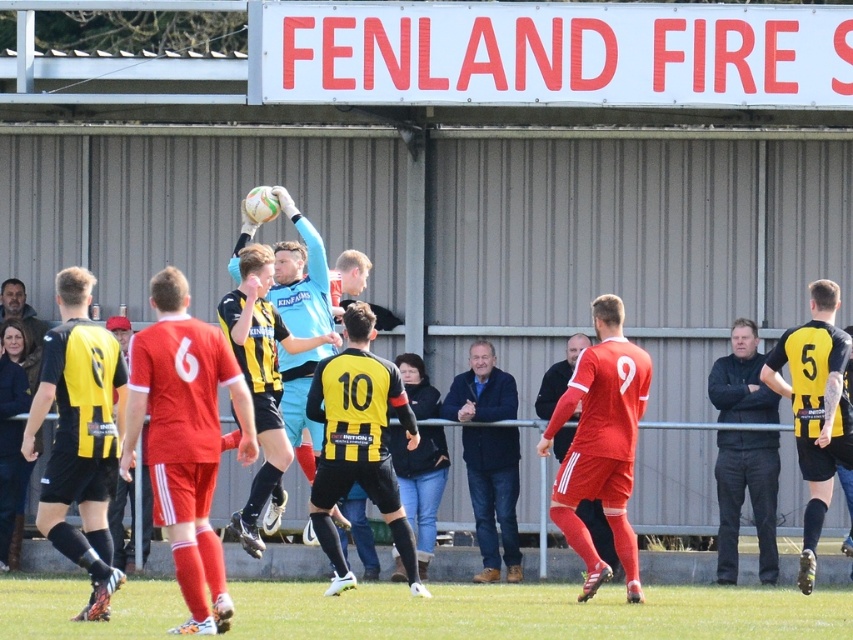
Can you confirm if black/yellow jersey at center is positioned above matte red jersey at center?

No.

Who is shorter, black/yellow jersey at center or matte red jersey at center?

matte red jersey at center

Locate an element on the screen. The height and width of the screenshot is (640, 853). black/yellow jersey at center is located at coordinates (80, 435).

Does green grass at center have a smaller size compared to matte blue goalkeeper at center?

Correct, green grass at center occupies less space than matte blue goalkeeper at center.

Where is `green grass at center`? The width and height of the screenshot is (853, 640). green grass at center is located at coordinates (535, 611).

This screenshot has width=853, height=640. I want to click on green grass at center, so click(x=535, y=611).

At what (x,y) coordinates should I click in order to perform the action: click on green grass at center. Please return your answer as a coordinate pair (x, y). Image resolution: width=853 pixels, height=640 pixels. Looking at the image, I should click on (535, 611).

Which is behind, point (526, 618) or point (718, 561)?

Point (718, 561)

Is point (602, 634) in front of point (733, 417)?

Yes, point (602, 634) is closer to viewer.

In order to click on green grass at center in this screenshot , I will do `click(535, 611)`.